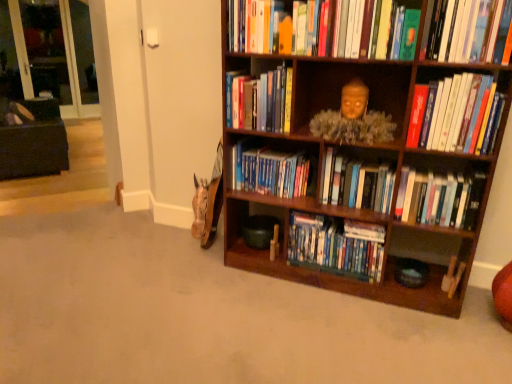
Question: From the image's perspective, does dark brown fabric bean bag chair at left appear higher than hardcover books at center, arranged as the second book when viewed from the top?

Choices:
 (A) yes
 (B) no

Answer: (A)

Question: Can you confirm if dark brown fabric bean bag chair at left is thinner than hardcover books at center, arranged as the second book when viewed from the top?

Choices:
 (A) no
 (B) yes

Answer: (A)

Question: From a real-world perspective, is dark brown fabric bean bag chair at left physically above hardcover books at center, arranged as the second book when viewed from the top?

Choices:
 (A) yes
 (B) no

Answer: (B)

Question: Is dark brown fabric bean bag chair at left to the right of hardcover books at center, which is counted as the 6th book, starting from the bottom, from the viewer's perspective?

Choices:
 (A) no
 (B) yes

Answer: (A)

Question: Does dark brown fabric bean bag chair at left appear on the left side of hardcover books at center, which is counted as the 6th book, starting from the bottom?

Choices:
 (A) yes
 (B) no

Answer: (A)

Question: From the image's perspective, is dark brown fabric bean bag chair at left below hardcover books at center, which is counted as the 6th book, starting from the bottom?

Choices:
 (A) yes
 (B) no

Answer: (B)

Question: Is hardcover books at upper right, which appears as the 3th book when viewed from the top, bigger than wooden bookcase at right?

Choices:
 (A) no
 (B) yes

Answer: (A)

Question: Is hardcover books at upper right, the fifth book when ordered from bottom to top, at the left side of wooden bookcase at right?

Choices:
 (A) no
 (B) yes

Answer: (A)

Question: Does hardcover books at upper right, the fifth book when ordered from bottom to top, have a smaller size compared to wooden bookcase at right?

Choices:
 (A) yes
 (B) no

Answer: (A)

Question: Is hardcover books at upper right, the fifth book when ordered from bottom to top, facing towards wooden bookcase at right?

Choices:
 (A) no
 (B) yes

Answer: (B)

Question: Is hardcover books at upper right, the fifth book when ordered from bottom to top, placed right next to wooden bookcase at right?

Choices:
 (A) no
 (B) yes

Answer: (A)

Question: From a real-world perspective, is hardcover books at upper right, which appears as the 3th book when viewed from the top, positioned under wooden bookcase at right based on gravity?

Choices:
 (A) yes
 (B) no

Answer: (B)

Question: Would you say hardcover books at center right, which appears as the second book when ordered from the bottom, is part of hardcover books at upper right, the fifth book when ordered from bottom to top,'s contents?

Choices:
 (A) no
 (B) yes

Answer: (A)